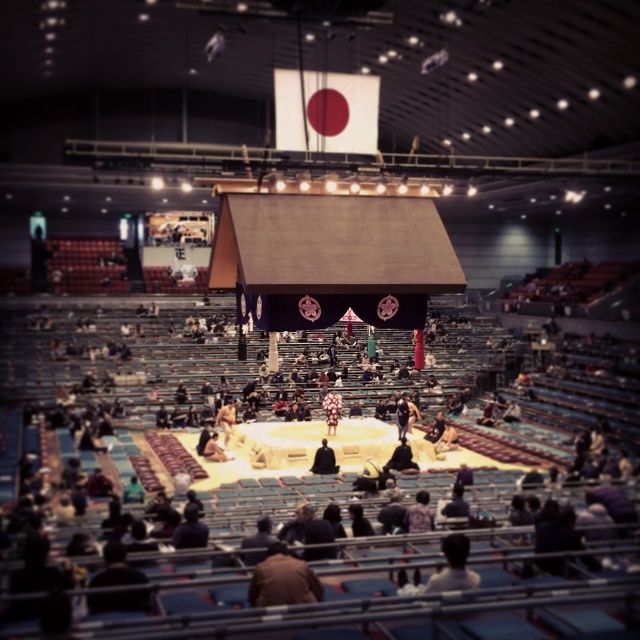
What do you see at coordinates (282, 579) in the screenshot? Image resolution: width=640 pixels, height=640 pixels. I see `brown leather jacket at lower center` at bounding box center [282, 579].

Where is `brown leather jacket at lower center`? brown leather jacket at lower center is located at coordinates click(282, 579).

Is light brown leather jacket at lower center bigger than dark blue fabric kimono at center?

Indeed, light brown leather jacket at lower center has a larger size compared to dark blue fabric kimono at center.

Who is more forward, (467, 540) or (404, 406)?

Point (467, 540) is in front.

This screenshot has width=640, height=640. Identify the location of light brown leather jacket at lower center. (452, 566).

Does dark blue fabric kimono at center appear on the left side of fluffy white kimono at center?

Incorrect, dark blue fabric kimono at center is not on the left side of fluffy white kimono at center.

Between point (404, 422) and point (323, 403), which one is positioned behind?

The point (323, 403) is more distant.

You are a GUI agent. You are given a task and a screenshot of the screen. Output one action in this format:
    pyautogui.click(x=<x>, y=<y>)
    Task: Click on the dark blue fabric kimono at center
    
    Given the screenshot: What is the action you would take?
    pyautogui.click(x=404, y=416)